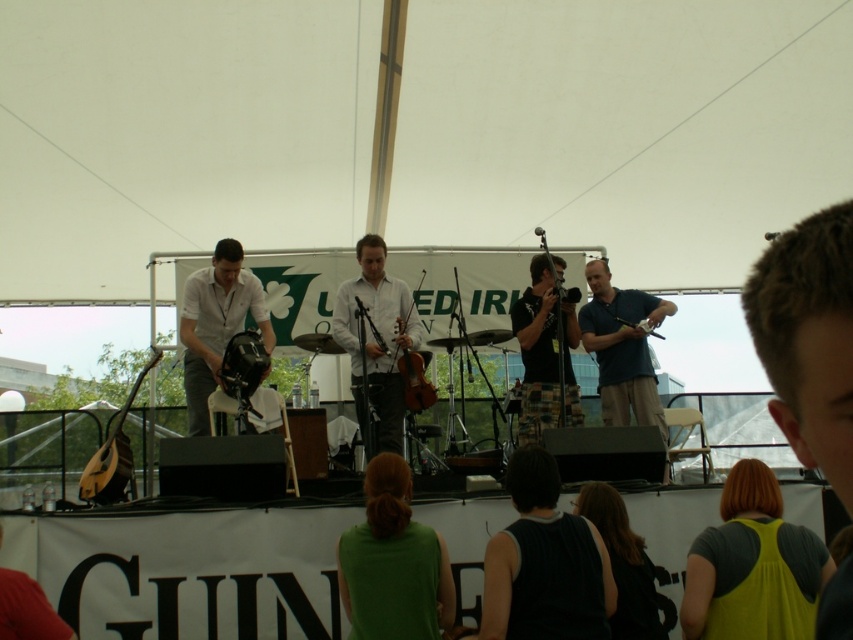
Question: Which object is the closest to the wooden violin at center?

Choices:
 (A) green fabric shirt at center
 (B) matte black helmet at center
 (C) brown wooden violin at center

Answer: (C)

Question: Which point is closer to the camera taking this photo?

Choices:
 (A) (396, 326)
 (B) (80, 477)
 (C) (397, 556)
 (D) (635, 380)

Answer: (C)

Question: Which of the following is the closest to the observer?

Choices:
 (A) (94, 492)
 (B) (587, 352)
 (C) (415, 396)
 (D) (395, 465)

Answer: (D)

Question: Is blue cotton shirt at center positioned before brown wooden violin at center?

Choices:
 (A) yes
 (B) no

Answer: (B)

Question: Is matte black helmet at center wider than wooden acoustic guitar at left?

Choices:
 (A) yes
 (B) no

Answer: (A)

Question: Does green fabric shirt at center appear under blue cotton shirt at center?

Choices:
 (A) no
 (B) yes

Answer: (B)